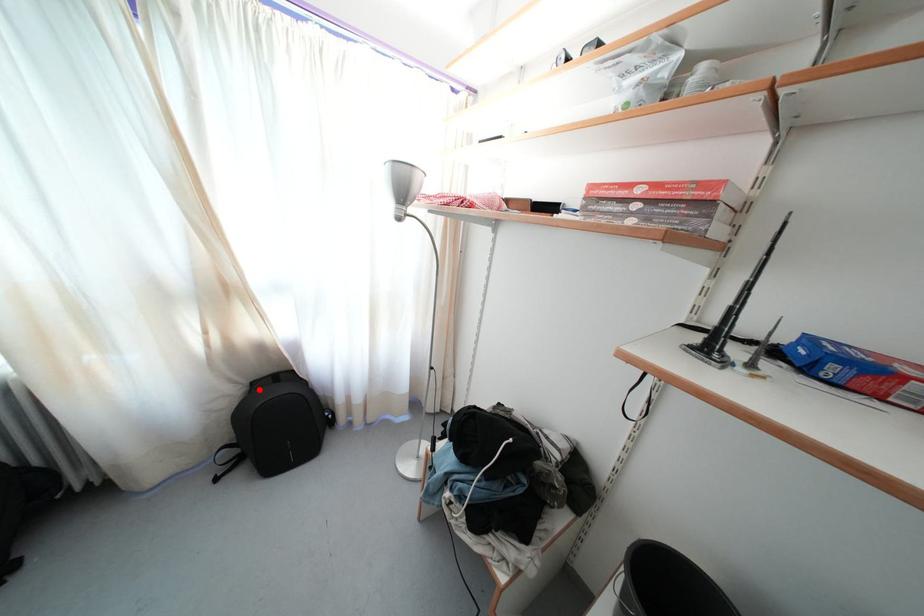
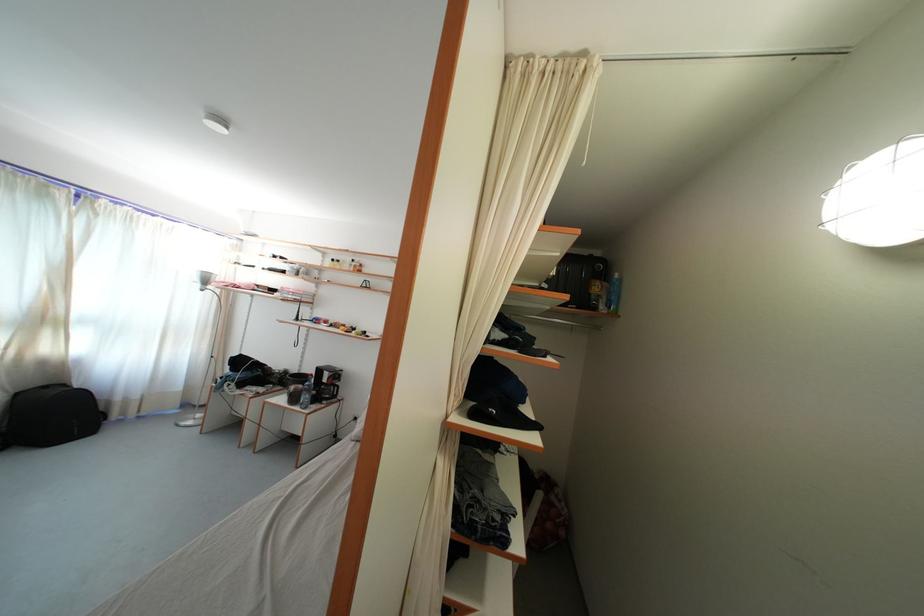
Question: I am providing you with two images of the same scene from different viewpoints. In image1, a red point is highlighted. Considering the same 3D point in image2, which of the following is correct?

Choices:
 (A) It is closer
 (B) It is farther

Answer: (B)